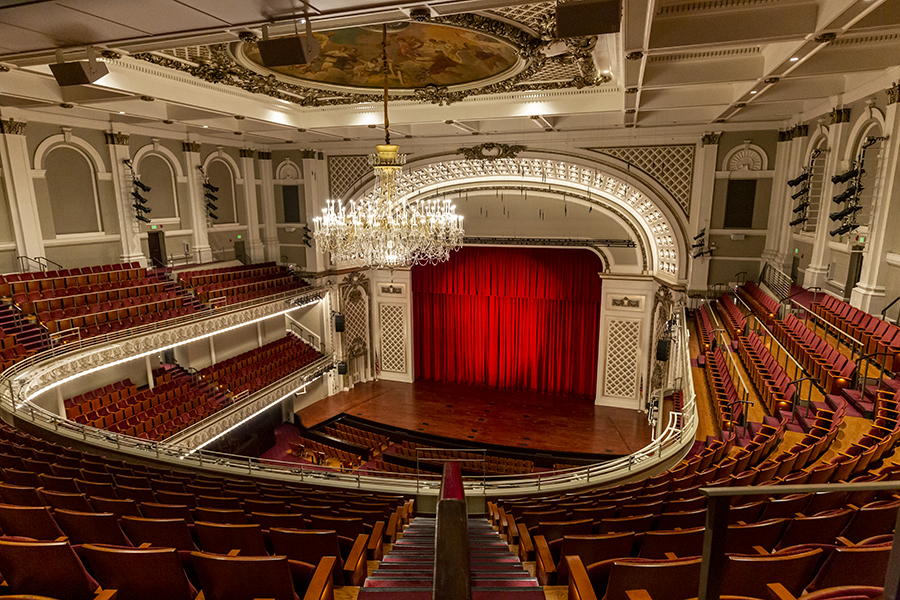
Where is `lights`? lights is located at coordinates (454, 410), (625, 198).